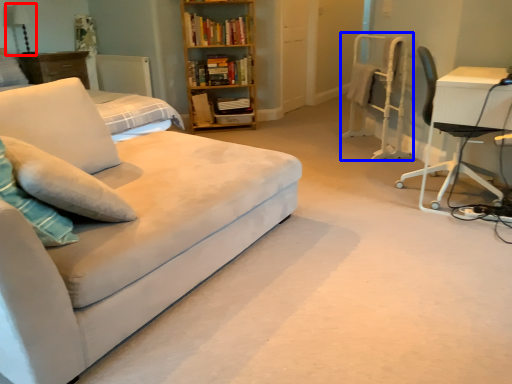
Question: Which object is closer to the camera taking this photo, table lamp (highlighted by a red box) or computer chair (highlighted by a blue box)?

Choices:
 (A) table lamp
 (B) computer chair

Answer: (B)